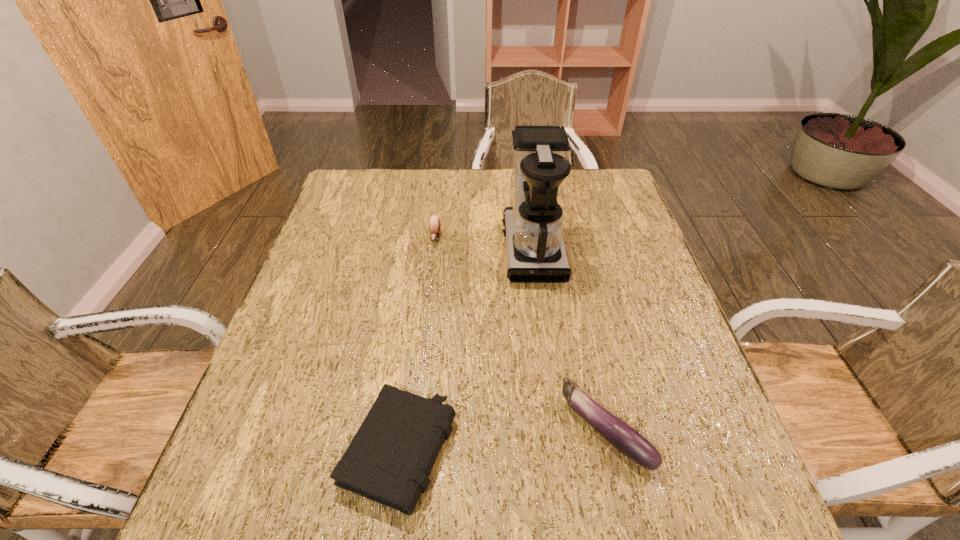
Locate an element on the screen. free spot between the escargot and the Bible is located at coordinates (418, 344).

Image resolution: width=960 pixels, height=540 pixels. Find the location of `vacant point located between the tallest object and the eggplant`. vacant point located between the tallest object and the eggplant is located at coordinates (569, 340).

Where is `unoccupied area between the eggplant and the escargot`? unoccupied area between the eggplant and the escargot is located at coordinates (520, 333).

This screenshot has height=540, width=960. Identify the location of free space between the eggplant and the tallest object. (569, 340).

Locate an element on the screen. unoccupied area between the coffee maker and the Bible is located at coordinates (466, 350).

Identify the location of vacant point located between the eggplant and the tallest object. (569, 340).

Identify the location of vacant space that's between the coffee maker and the eggplant. (569, 340).

Where is `object that is the third closest one to the eggplant`? The image size is (960, 540). object that is the third closest one to the eggplant is located at coordinates (434, 223).

This screenshot has height=540, width=960. I want to click on object that stands as the second closest to the Bible, so click(x=533, y=228).

Locate an element on the screen. This screenshot has width=960, height=540. free spot that satisfies the following two spatial constraints: 1. at the front of the tallest object where the controls are located; 2. on the right side of the eggplant is located at coordinates (556, 430).